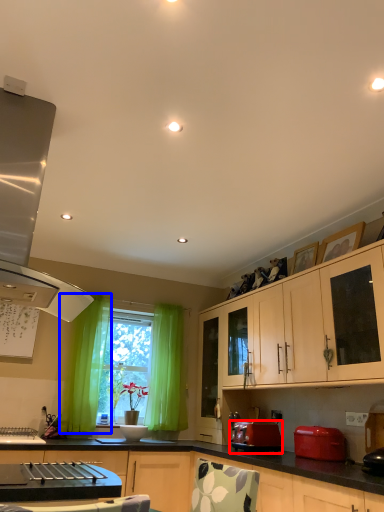
Question: Which point is closer to the camera, toaster (highlighted by a red box) or curtain (highlighted by a blue box)?

Choices:
 (A) toaster
 (B) curtain

Answer: (A)